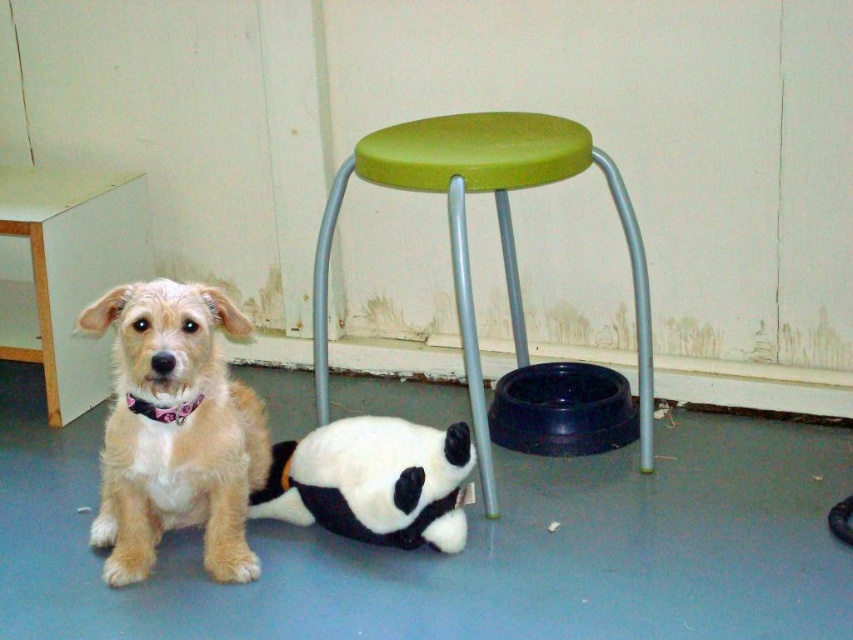
Is point (202, 534) in front of point (378, 465)?

No, (202, 534) is behind (378, 465).

Does fuzzy beige dog at lower left appear on the left side of soft plush panda at lower center?

Yes, fuzzy beige dog at lower left is to the left of soft plush panda at lower center.

Locate an element on the screen. The width and height of the screenshot is (853, 640). fuzzy beige dog at lower left is located at coordinates (175, 429).

Does fuzzy beige dog at lower left appear on the right side of green plastic stool at upper center?

Yes, fuzzy beige dog at lower left is to the right of green plastic stool at upper center.

Can you confirm if fuzzy beige dog at lower left is bigger than green plastic stool at upper center?

Indeed, fuzzy beige dog at lower left has a larger size compared to green plastic stool at upper center.

Between point (137, 344) and point (102, 275), which one is positioned in front?

Positioned in front is point (137, 344).

The image size is (853, 640). In order to click on fuzzy beige dog at lower left in this screenshot , I will do `click(175, 429)`.

Can you confirm if green plastic stool at center is thinner than soft plush panda at lower center?

Incorrect, green plastic stool at center's width is not less than soft plush panda at lower center's.

Is green plastic stool at center above soft plush panda at lower center?

Yes.

Where is `green plastic stool at center`? The width and height of the screenshot is (853, 640). green plastic stool at center is located at coordinates (498, 230).